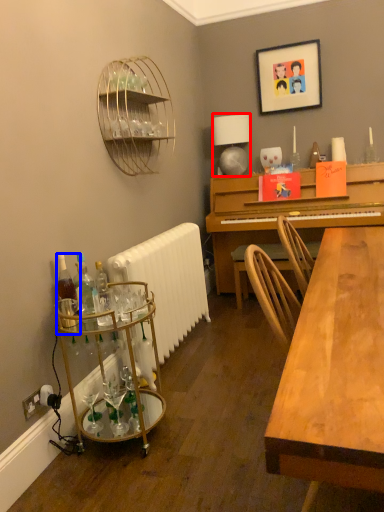
Question: Which point is further to the camera, lamp (highlighted by a red box) or bottle (highlighted by a blue box)?

Choices:
 (A) lamp
 (B) bottle

Answer: (A)